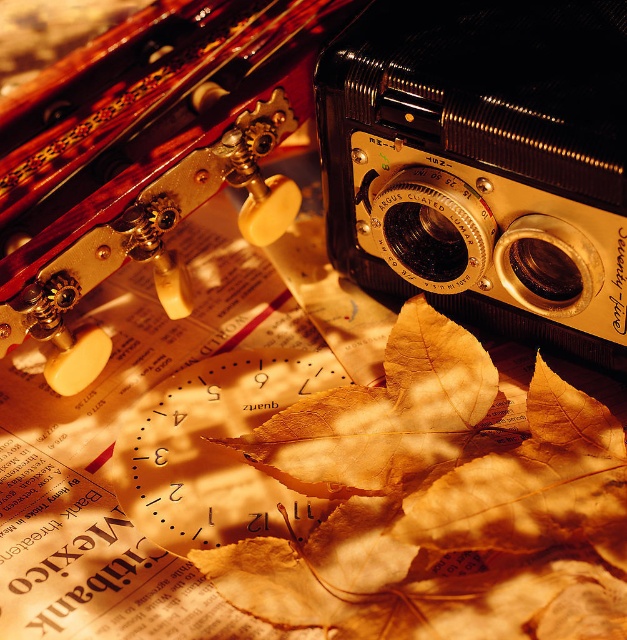
Question: Where is gold metallic camera at center located in relation to golden dried leaf at center in the image?

Choices:
 (A) left
 (B) right

Answer: (B)

Question: Which object is farther from the camera taking this photo?

Choices:
 (A) golden dried leaf at center
 (B) gold metallic camera at center

Answer: (A)

Question: Among these points, which one is nearest to the camera?

Choices:
 (A) (522, 17)
 (B) (423, 307)

Answer: (A)

Question: Is gold metallic camera at center behind golden dried leaf at center?

Choices:
 (A) yes
 (B) no

Answer: (B)

Question: Can you confirm if gold metallic camera at center is positioned to the left of golden dried leaf at center?

Choices:
 (A) yes
 (B) no

Answer: (B)